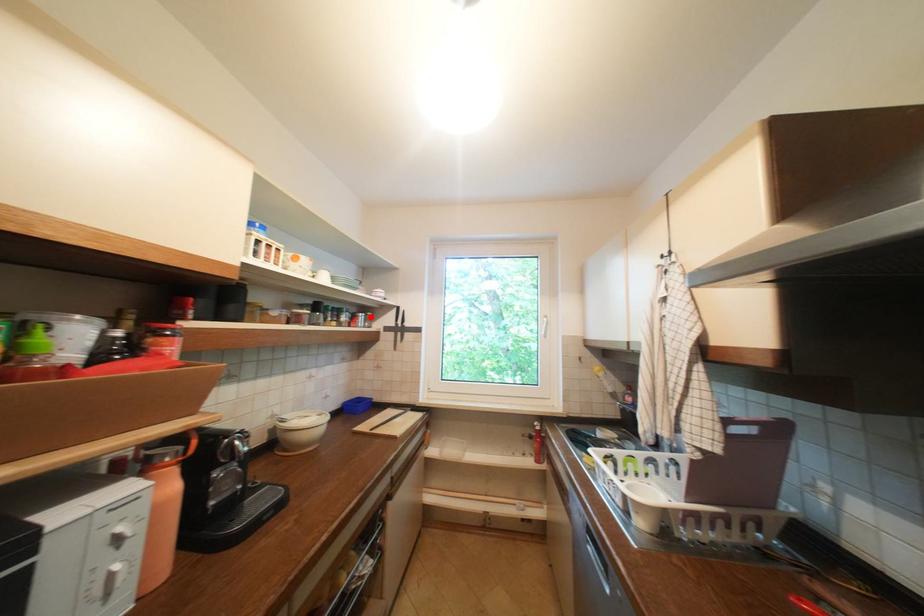
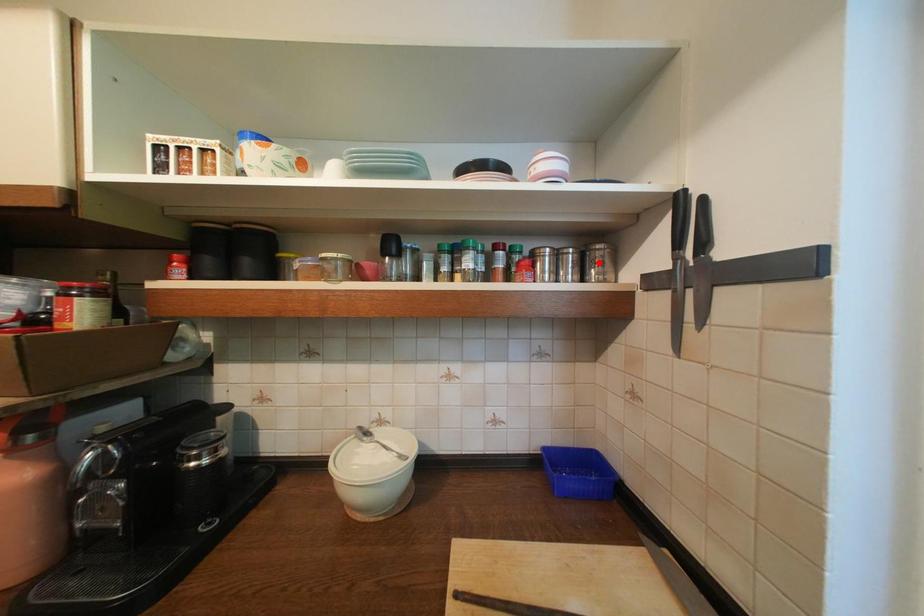
I am providing you with two images of the same scene from different viewpoints. A red point is marked on the first image and another point is marked on the second image. Are the points marked in image1 and image2 representing the same 3D position?

No